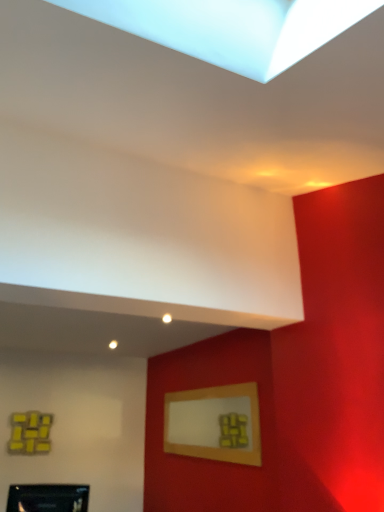
The image size is (384, 512). Identify the location of matte black picture frame at lower left, which is the first picture frame from left to right. (48, 498).

What do you see at coordinates (48, 498) in the screenshot? This screenshot has width=384, height=512. I see `matte black picture frame at lower left, acting as the second picture frame starting from the back` at bounding box center [48, 498].

Measure the distance between wooden picture frame at upper center, the 1th picture frame positioned from the back, and camera.

wooden picture frame at upper center, the 1th picture frame positioned from the back, is 3.10 meters away from camera.

Image resolution: width=384 pixels, height=512 pixels. Describe the element at coordinates (214, 423) in the screenshot. I see `wooden picture frame at upper center, the 1th picture frame positioned from the back` at that location.

The height and width of the screenshot is (512, 384). What are the coordinates of `wooden picture frame at upper center, arranged as the second picture frame when viewed from the front` in the screenshot? It's located at (214, 423).

In order to click on matte black picture frame at lower left, acting as the second picture frame starting from the back in this screenshot , I will do `click(48, 498)`.

Which is more to the right, wooden picture frame at upper center, arranged as the second picture frame when viewed from the front, or matte black picture frame at lower left, which appears as the 1th picture frame when viewed from the front?

wooden picture frame at upper center, arranged as the second picture frame when viewed from the front.

Between wooden picture frame at upper center, arranged as the second picture frame when viewed from the front, and matte black picture frame at lower left, which appears as the 1th picture frame when viewed from the front, which one is positioned in front?

matte black picture frame at lower left, which appears as the 1th picture frame when viewed from the front, is closer to the camera.

Is point (233, 452) more distant than point (80, 507)?

Yes, it is.

From the image's perspective, would you say wooden picture frame at upper center, the 1th picture frame from the right, is positioned over matte black picture frame at lower left, acting as the second picture frame starting from the back?

Yes, from the image's perspective, wooden picture frame at upper center, the 1th picture frame from the right, is over matte black picture frame at lower left, acting as the second picture frame starting from the back.

In the scene shown: From a real-world perspective, is wooden picture frame at upper center, the second picture frame positioned from the left, physically located above or below matte black picture frame at lower left, which appears as the 1th picture frame when viewed from the front?

wooden picture frame at upper center, the second picture frame positioned from the left, is situated higher than matte black picture frame at lower left, which appears as the 1th picture frame when viewed from the front, in the real world.

In the scene shown: Is wooden picture frame at upper center, the second picture frame positioned from the left, wider or thinner than matte black picture frame at lower left, acting as the second picture frame starting from the back?

Clearly, wooden picture frame at upper center, the second picture frame positioned from the left, has less width compared to matte black picture frame at lower left, acting as the second picture frame starting from the back.

Can you confirm if wooden picture frame at upper center, arranged as the second picture frame when viewed from the front, is taller than matte black picture frame at lower left, acting as the second picture frame starting from the back?

Yes, wooden picture frame at upper center, arranged as the second picture frame when viewed from the front, is taller than matte black picture frame at lower left, acting as the second picture frame starting from the back.

From the picture: Which of these two, wooden picture frame at upper center, the 1th picture frame positioned from the back, or matte black picture frame at lower left, placed as the second picture frame when sorted from right to left, is bigger?

Bigger between the two is wooden picture frame at upper center, the 1th picture frame positioned from the back.

Is wooden picture frame at upper center, the 1th picture frame positioned from the back, surrounding matte black picture frame at lower left, acting as the second picture frame starting from the back?

No.

Is there a large distance between wooden picture frame at upper center, the 1th picture frame from the right, and matte black picture frame at lower left, which is the first picture frame from left to right?

Yes.

Is wooden picture frame at upper center, the second picture frame positioned from the left, turned away from matte black picture frame at lower left, which appears as the 1th picture frame when viewed from the front?

wooden picture frame at upper center, the second picture frame positioned from the left, does not have its back to matte black picture frame at lower left, which appears as the 1th picture frame when viewed from the front.

How many degrees apart are the facing directions of wooden picture frame at upper center, the second picture frame positioned from the left, and matte black picture frame at lower left, which appears as the 1th picture frame when viewed from the front?

wooden picture frame at upper center, the second picture frame positioned from the left, and matte black picture frame at lower left, which appears as the 1th picture frame when viewed from the front, are facing 73.8 degrees away from each other.

How much distance is there between wooden picture frame at upper center, the second picture frame positioned from the left, and matte black picture frame at lower left, which is the first picture frame from left to right?

wooden picture frame at upper center, the second picture frame positioned from the left, is 1.28 meters from matte black picture frame at lower left, which is the first picture frame from left to right.

Locate an element on the screen. The height and width of the screenshot is (512, 384). picture frame positioned vertically above the matte black picture frame at lower left, placed as the second picture frame when sorted from right to left (from a real-world perspective) is located at coordinates (214, 423).

Visually, is matte black picture frame at lower left, acting as the second picture frame starting from the back, positioned to the left or to the right of wooden picture frame at upper center, arranged as the second picture frame when viewed from the front?

In the image, matte black picture frame at lower left, acting as the second picture frame starting from the back, appears on the left side of wooden picture frame at upper center, arranged as the second picture frame when viewed from the front.

Who is more distant, matte black picture frame at lower left, which is the first picture frame from left to right, or wooden picture frame at upper center, arranged as the second picture frame when viewed from the front?

wooden picture frame at upper center, arranged as the second picture frame when viewed from the front.

Is point (54, 509) farther from camera compared to point (237, 462)?

No.

From the image's perspective, which one is positioned lower, matte black picture frame at lower left, which is the first picture frame from left to right, or wooden picture frame at upper center, the 1th picture frame from the right?

matte black picture frame at lower left, which is the first picture frame from left to right, appears lower in the image.

From a real-world perspective, which object rests below the other?

matte black picture frame at lower left, acting as the second picture frame starting from the back, is physically lower.

From the picture: Which of these two, matte black picture frame at lower left, which appears as the 1th picture frame when viewed from the front, or wooden picture frame at upper center, the second picture frame positioned from the left, is thinner?

wooden picture frame at upper center, the second picture frame positioned from the left, is thinner.

Does matte black picture frame at lower left, which is the first picture frame from left to right, have a lesser height compared to wooden picture frame at upper center, arranged as the second picture frame when viewed from the front?

Indeed, matte black picture frame at lower left, which is the first picture frame from left to right, has a lesser height compared to wooden picture frame at upper center, arranged as the second picture frame when viewed from the front.

Considering the sizes of objects matte black picture frame at lower left, acting as the second picture frame starting from the back, and wooden picture frame at upper center, the second picture frame positioned from the left, in the image provided, who is bigger, matte black picture frame at lower left, acting as the second picture frame starting from the back, or wooden picture frame at upper center, the second picture frame positioned from the left,?

Bigger between the two is wooden picture frame at upper center, the second picture frame positioned from the left.

Is wooden picture frame at upper center, the 1th picture frame from the right, completely or partially inside matte black picture frame at lower left, which appears as the 1th picture frame when viewed from the front?

No, wooden picture frame at upper center, the 1th picture frame from the right, is not surrounded by matte black picture frame at lower left, which appears as the 1th picture frame when viewed from the front.

Are matte black picture frame at lower left, which is the first picture frame from left to right, and wooden picture frame at upper center, the 1th picture frame positioned from the back, beside each other?

matte black picture frame at lower left, which is the first picture frame from left to right, is not next to wooden picture frame at upper center, the 1th picture frame positioned from the back, and they're not touching.

From the picture: Is matte black picture frame at lower left, which appears as the 1th picture frame when viewed from the front, facing away from wooden picture frame at upper center, the second picture frame positioned from the left?

No, wooden picture frame at upper center, the second picture frame positioned from the left, is not at the back of matte black picture frame at lower left, which appears as the 1th picture frame when viewed from the front.

How distant is matte black picture frame at lower left, acting as the second picture frame starting from the back, from wooden picture frame at upper center, arranged as the second picture frame when viewed from the front?

They are 4.18 feet apart.

You are a GUI agent. You are given a task and a screenshot of the screen. Output one action in this format:
    pyautogui.click(x=<x>, y=<y>)
    Task: Click on the picture frame below the wooden picture frame at upper center, arranged as the second picture frame when viewed from the front (from a real-world perspective)
    
    Given the screenshot: What is the action you would take?
    pyautogui.click(x=48, y=498)

At what (x,y) coordinates should I click in order to perform the action: click on picture frame behind the matte black picture frame at lower left, acting as the second picture frame starting from the back. Please return your answer as a coordinate pair (x, y). The height and width of the screenshot is (512, 384). Looking at the image, I should click on (214, 423).

Where is `picture frame that is above the matte black picture frame at lower left, which appears as the 1th picture frame when viewed from the front (from the image's perspective)`? The height and width of the screenshot is (512, 384). picture frame that is above the matte black picture frame at lower left, which appears as the 1th picture frame when viewed from the front (from the image's perspective) is located at coordinates (214, 423).